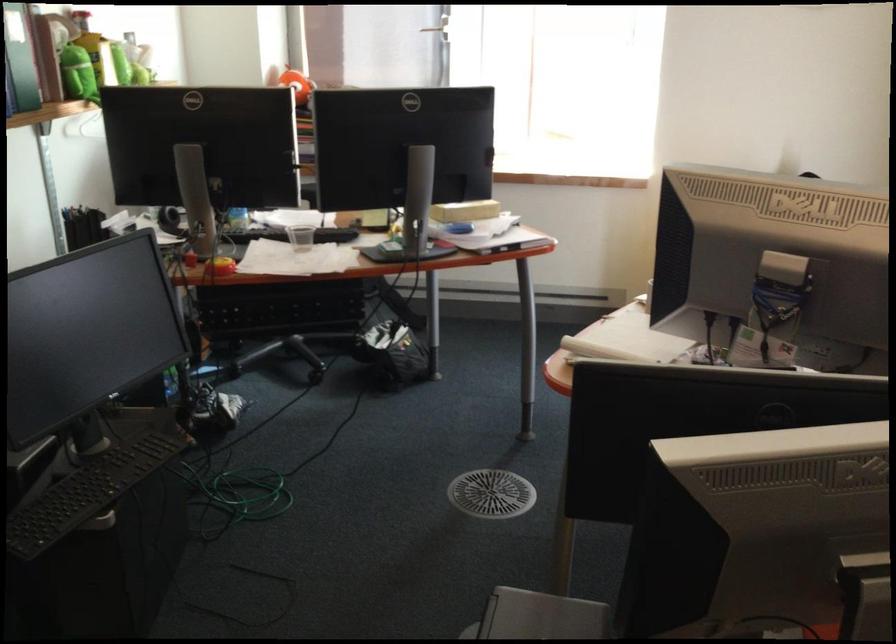
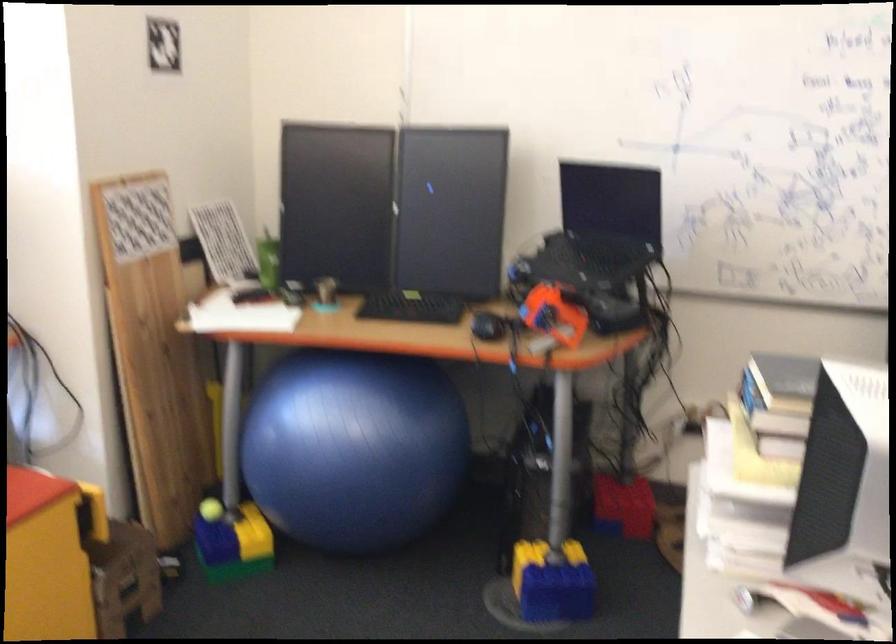
Question: The images are taken continuously from a first-person perspective. In which direction is your viewpoint rotating?

Choices:
 (A) Left
 (B) Right
 (C) Up
 (D) Down

Answer: (B)